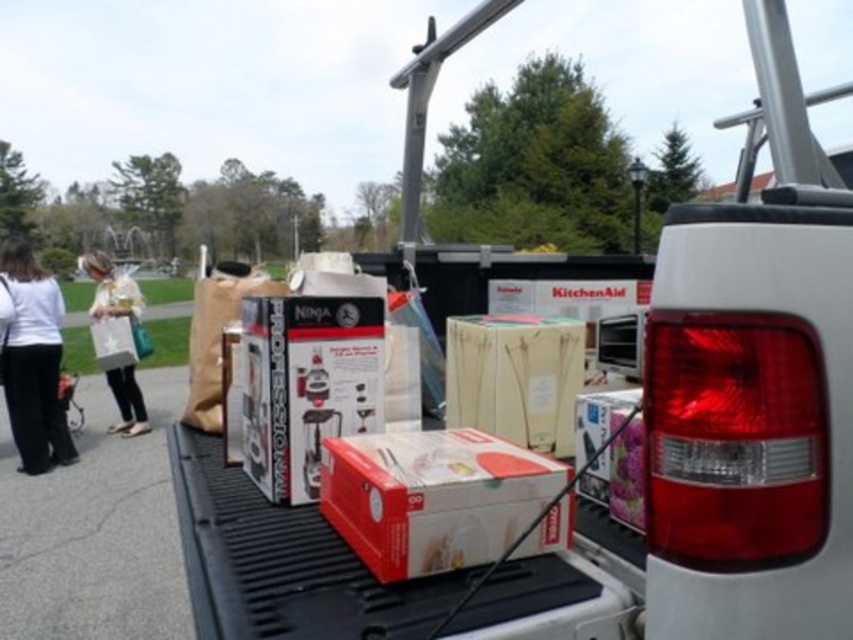
Based on the photo, does white cotton shirt at left appear over white paper bag at left?

No, white cotton shirt at left is not above white paper bag at left.

Is white cotton shirt at left to the left of white paper bag at left from the viewer's perspective?

Incorrect, white cotton shirt at left is not on the left side of white paper bag at left.

Describe the element at coordinates (32, 358) in the screenshot. I see `white cotton shirt at left` at that location.

The width and height of the screenshot is (853, 640). I want to click on white cotton shirt at left, so click(x=32, y=358).

Is red matte cardboard box at center thinner than white paper bag at left?

Yes, red matte cardboard box at center is thinner than white paper bag at left.

Is red matte cardboard box at center positioned before white paper bag at left?

Yes, red matte cardboard box at center is closer to the viewer.

Where is `red matte cardboard box at center`? This screenshot has height=640, width=853. red matte cardboard box at center is located at coordinates (432, 497).

Does red matte cardboard box at center have a lesser height compared to white cotton shirt at left?

Yes.

Does red matte cardboard box at center have a lesser width compared to white cotton shirt at left?

Yes, red matte cardboard box at center is thinner than white cotton shirt at left.

Does point (434, 516) come in front of point (30, 337)?

Yes, point (434, 516) is closer to viewer.

Locate an element on the screen. The image size is (853, 640). red matte cardboard box at center is located at coordinates (432, 497).